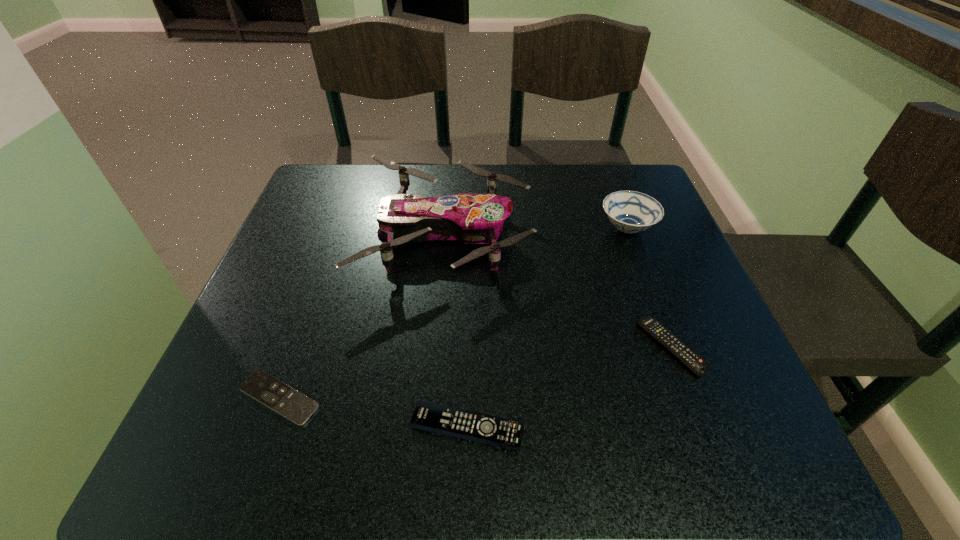
The height and width of the screenshot is (540, 960). Identify the location of vacant point at the left edge. (264, 313).

Locate an element on the screen. vacant space at the right edge of the desktop is located at coordinates (673, 228).

The height and width of the screenshot is (540, 960). In order to click on vacant space at the far left corner of the desktop in this screenshot , I will do `click(349, 165)`.

You are a GUI agent. You are given a task and a screenshot of the screen. Output one action in this format:
    pyautogui.click(x=<x>, y=<y>)
    Task: Click on the free space at the far right corner of the desktop
    
    Given the screenshot: What is the action you would take?
    pyautogui.click(x=586, y=180)

Locate an element on the screen. The image size is (960, 540). free region at the near right corner is located at coordinates (722, 416).

Locate an element on the screen. This screenshot has height=540, width=960. free point between the soup bowl and the rightmost remote control is located at coordinates (649, 288).

Where is `free space that is in between the leftmost remote control and the rightmost remote control`? free space that is in between the leftmost remote control and the rightmost remote control is located at coordinates (474, 372).

Locate an element on the screen. The image size is (960, 540). vacant area that lies between the second remote control from right to left and the shortest remote control is located at coordinates (373, 413).

What are the coordinates of `empty space between the soup bowl and the drone` in the screenshot? It's located at (537, 232).

This screenshot has height=540, width=960. What are the coordinates of `unoccupied position between the rightmost remote control and the second tallest object` in the screenshot? It's located at (649, 288).